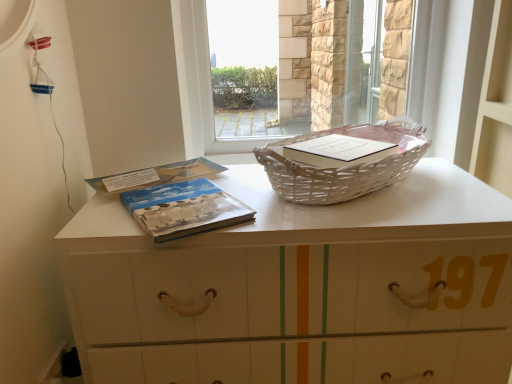
Question: Considering the positions of blue matte book at center, the second paperback book when ordered from front to back, and white wicker picnic basket at center in the image, is blue matte book at center, the second paperback book when ordered from front to back, taller or shorter than white wicker picnic basket at center?

Choices:
 (A) short
 (B) tall

Answer: (A)

Question: Is point (122, 173) closer or farther from the camera than point (380, 120)?

Choices:
 (A) farther
 (B) closer

Answer: (B)

Question: Based on their relative distances, which object is farther from the white wicker basket at upper center?

Choices:
 (A) transparent plastic basket at upper center
 (B) matte blue cover book at center, which is counted as the second paperback book, starting from the back
 (C) blue matte book at center, the second paperback book when ordered from front to back
 (D) white wicker picnic basket at center

Answer: (A)

Question: Estimate the real-world distances between objects in this image. Which object is farther from the white wicker picnic basket at center?

Choices:
 (A) transparent plastic basket at upper center
 (B) matte blue cover book at center, the first paperback book positioned from the front
 (C) white wicker basket at upper center
 (D) blue matte book at center, which is counted as the first paperback book, starting from the back

Answer: (A)